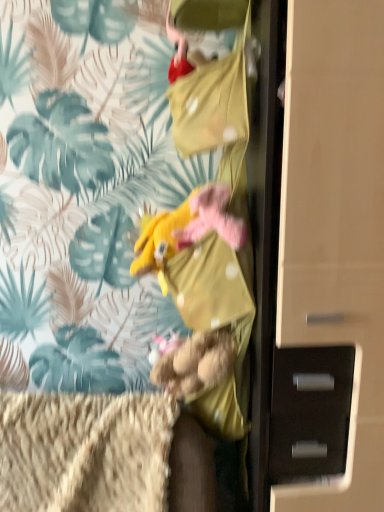
This screenshot has height=512, width=384. Describe the element at coordinates (335, 233) in the screenshot. I see `matte white dresser at right` at that location.

The image size is (384, 512). I want to click on matte white dresser at right, so click(335, 233).

Measure the distance between point (x=362, y=101) and camera.

The distance of point (x=362, y=101) from camera is 28.35 inches.

Identify the location of matte white dresser at right. Image resolution: width=384 pixels, height=512 pixels. point(335,233).